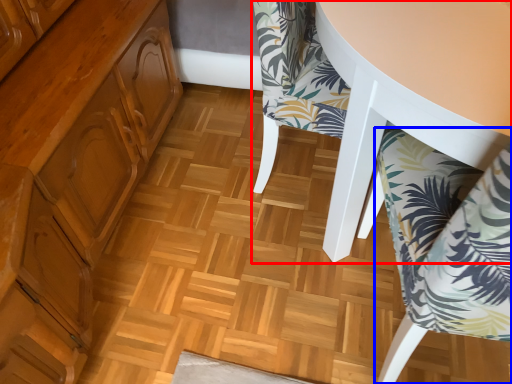
Question: Which object appears closest to the camera in this image, chair (highlighted by a red box) or chair (highlighted by a blue box)?

Choices:
 (A) chair
 (B) chair

Answer: (B)